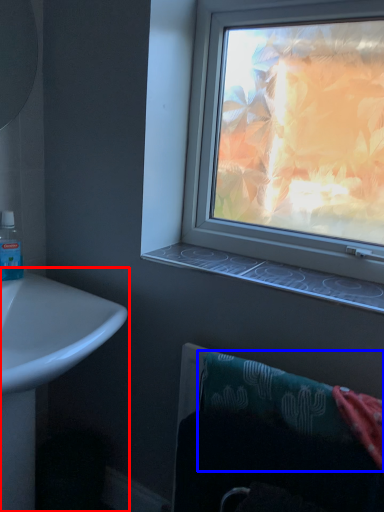
Question: Among these objects, which one is farthest to the camera, sink (highlighted by a red box) or bath towel (highlighted by a blue box)?

Choices:
 (A) sink
 (B) bath towel

Answer: (B)